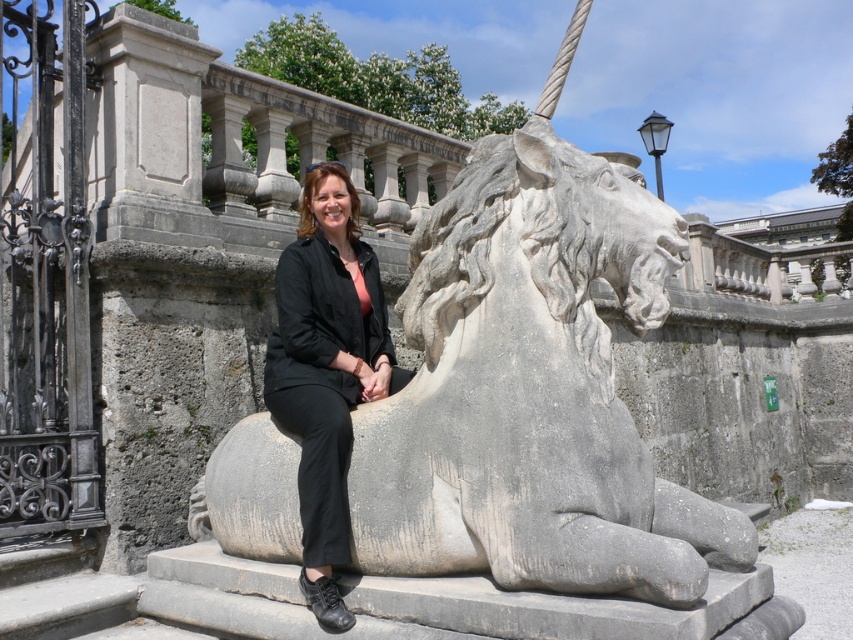
Question: Is gray stone horse at center to the left of black fabric jacket at center from the viewer's perspective?

Choices:
 (A) yes
 (B) no

Answer: (B)

Question: Among these objects, which one is farthest from the camera?

Choices:
 (A) gray stone horse at center
 (B) black fabric jacket at center

Answer: (B)

Question: Does gray stone horse at center have a smaller size compared to black fabric jacket at center?

Choices:
 (A) no
 (B) yes

Answer: (A)

Question: Is gray stone horse at center to the left of black fabric jacket at center from the viewer's perspective?

Choices:
 (A) yes
 (B) no

Answer: (B)

Question: Which of the following is the closest to the observer?

Choices:
 (A) (660, 211)
 (B) (401, 372)

Answer: (A)